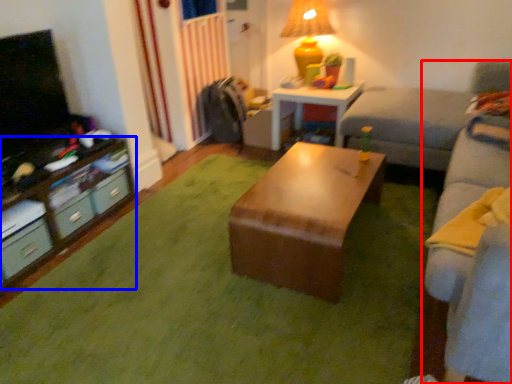
Question: Which of the following is the closest to the observer, studio couch (highlighted by a red box) or desk (highlighted by a blue box)?

Choices:
 (A) studio couch
 (B) desk

Answer: (A)